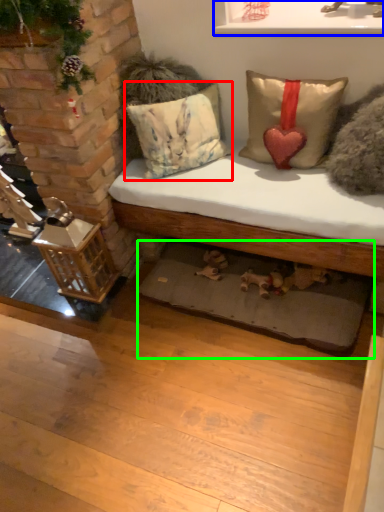
Question: Which object is the closest to the pillow (highlighted by a red box)? Choose among these: window sill (highlighted by a blue box) or mat (highlighted by a green box).

Choices:
 (A) window sill
 (B) mat

Answer: (A)